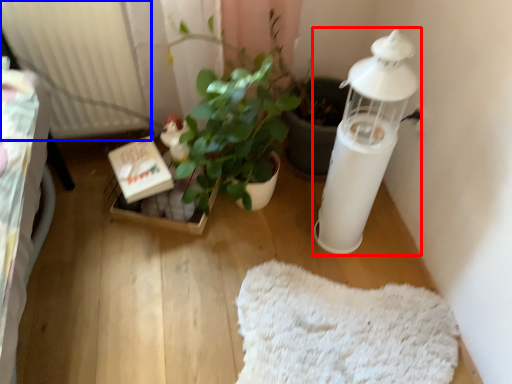
Question: Among these objects, which one is farthest to the camera, candle holder (highlighted by a red box) or radiator (highlighted by a blue box)?

Choices:
 (A) candle holder
 (B) radiator

Answer: (B)